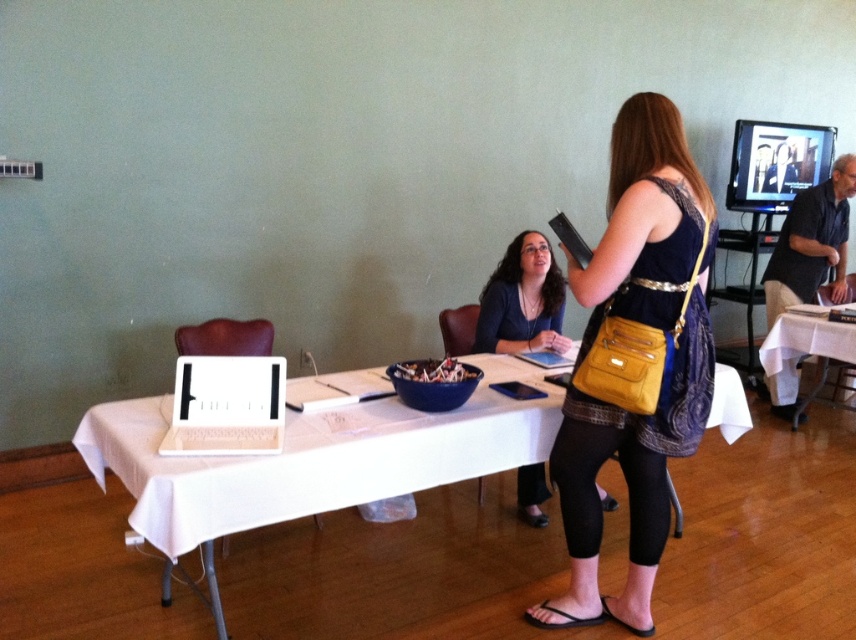
Question: Which point is closer to the camera taking this photo?

Choices:
 (A) click(x=512, y=321)
 (B) click(x=842, y=282)

Answer: (A)

Question: Can you confirm if white fabric table at center is smaller than white plastic laptop at center?

Choices:
 (A) no
 (B) yes

Answer: (A)

Question: Which of the following is the farthest from the observer?

Choices:
 (A) (851, 161)
 (B) (248, 452)
 (C) (556, 362)

Answer: (A)

Question: Is dark gray shirt at right positioned behind white matte laptop at center?

Choices:
 (A) yes
 (B) no

Answer: (A)

Question: Can you confirm if white fabric table at center is positioned above matte black shirt at center?

Choices:
 (A) no
 (B) yes

Answer: (A)

Question: Which is farther from the white plastic laptop at center?

Choices:
 (A) matte black shirt at center
 (B) dark gray shirt at right
 (C) white matte laptop at center
 (D) white cloth-covered table at right

Answer: (B)